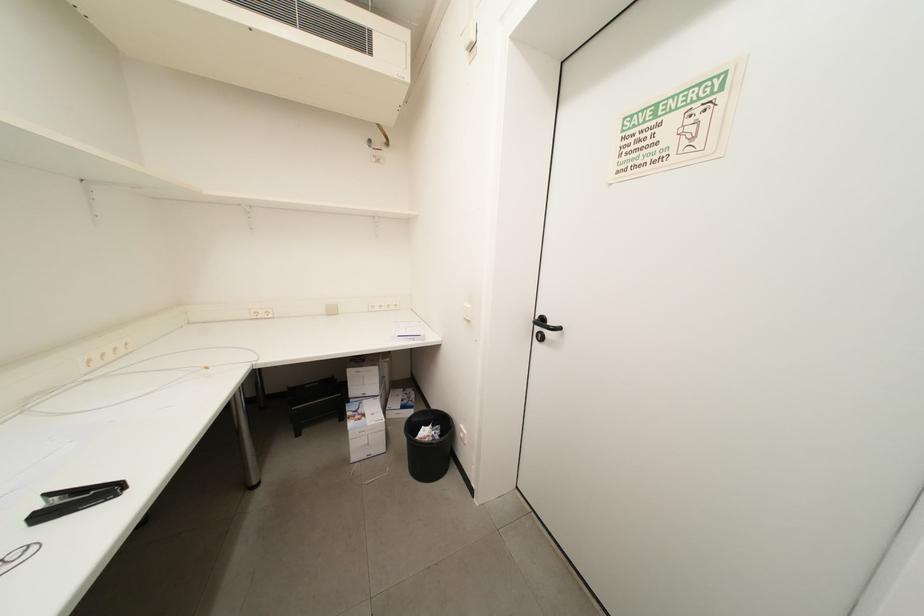
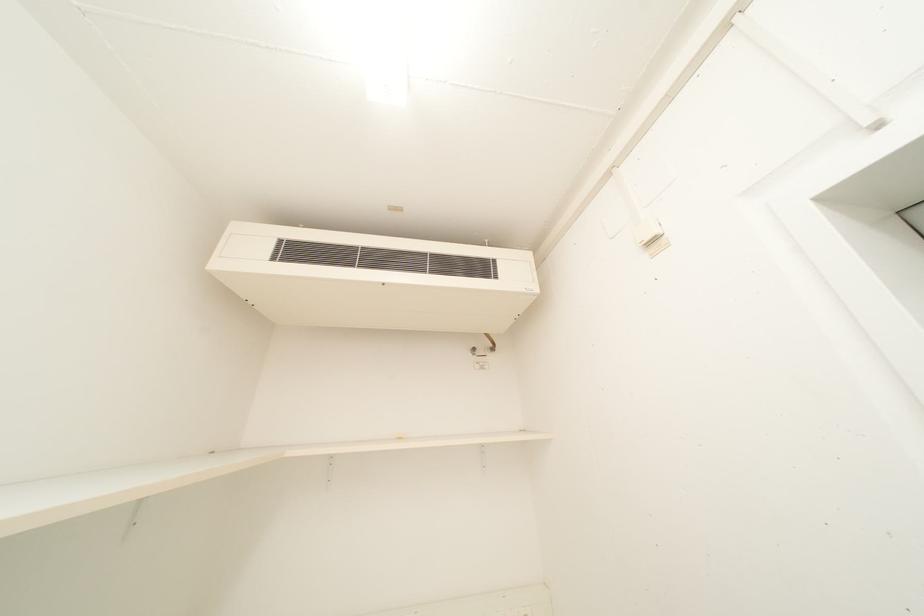
Question: The first image is from the beginning of the video and the second image is from the end. How did the camera likely rotate when shooting the video?

Choices:
 (A) Left
 (B) Right
 (C) Up
 (D) Down

Answer: (C)